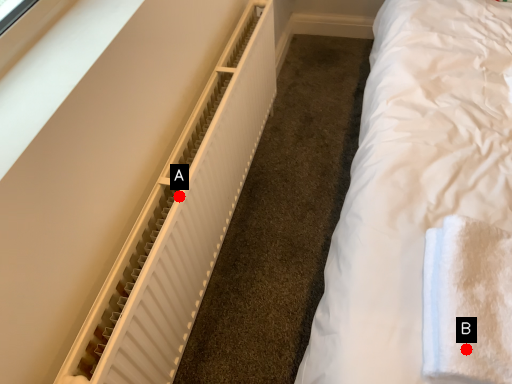
Question: Two points are circled on the image, labeled by A and B beside each circle. Which point is farther to the camera?

Choices:
 (A) A is further
 (B) B is further

Answer: (A)